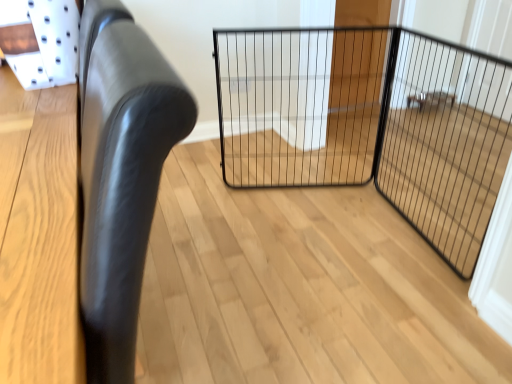
What are the coordinates of `free space on the front side of black wire mesh gate at center` in the screenshot? It's located at (317, 248).